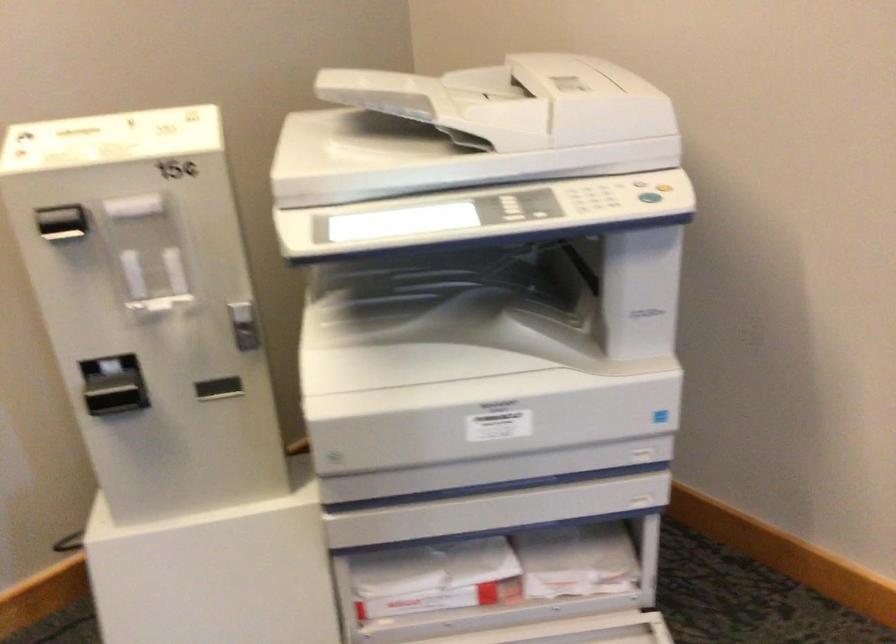
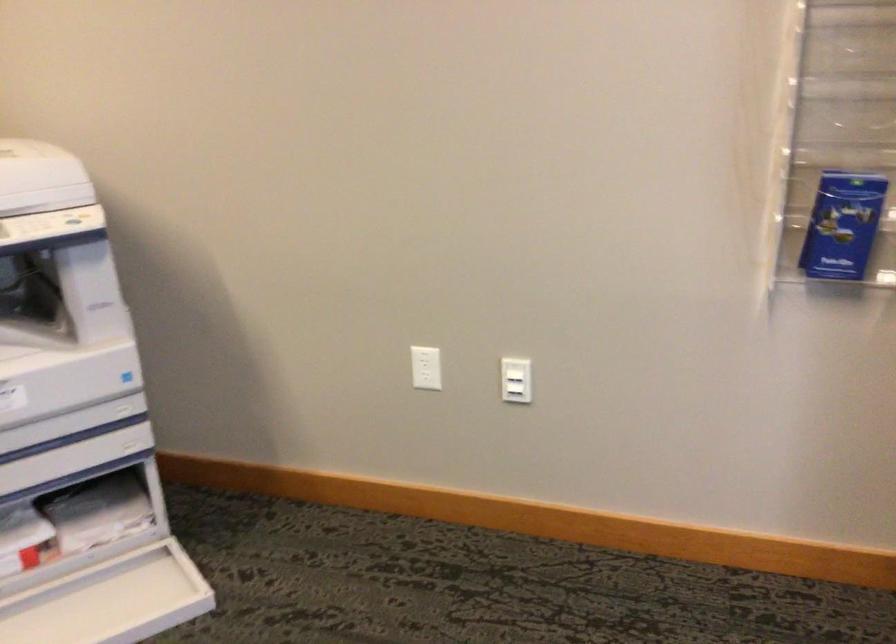
Find the pixel in the second image that matches (560,567) in the first image.

(91, 523)